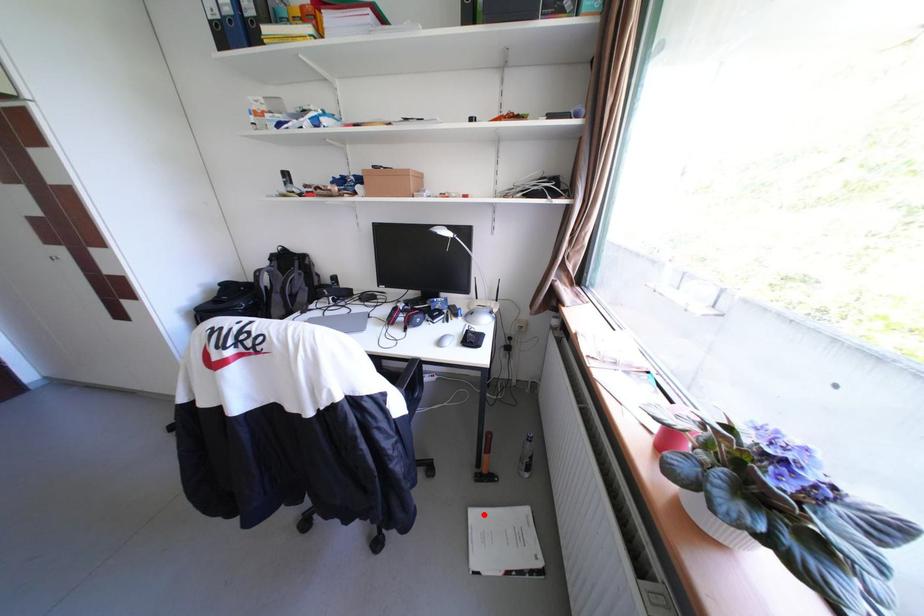
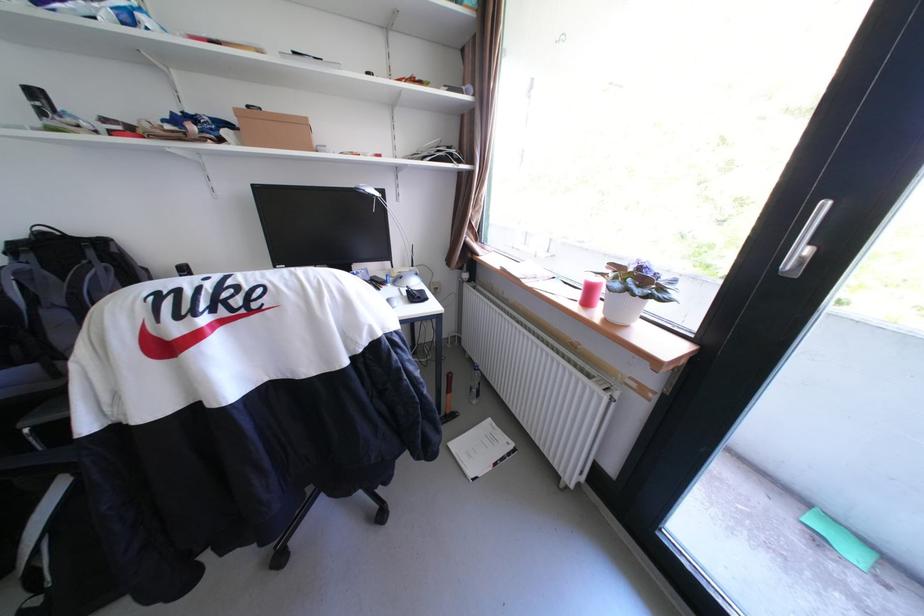
Find the pixel in the second image that matches the highlighted location in the first image.

(464, 446)